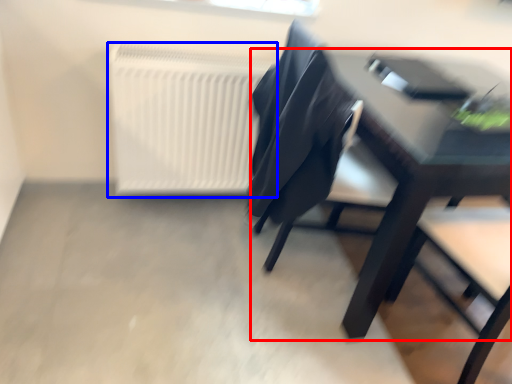
Question: Which object appears farthest to the camera in this image, table (highlighted by a red box) or radiator (highlighted by a blue box)?

Choices:
 (A) table
 (B) radiator

Answer: (B)